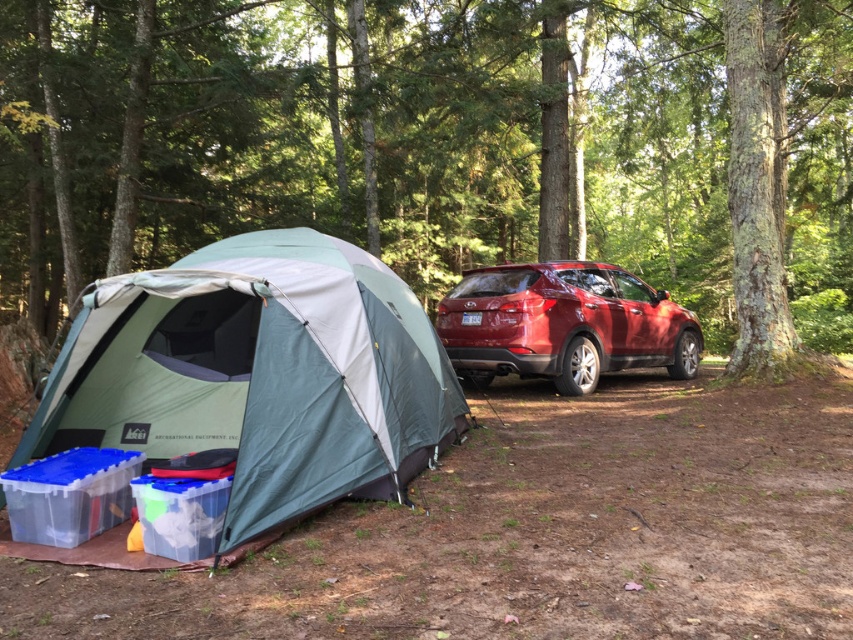
Is green textured tree at center shorter than green fabric tent at left?

In fact, green textured tree at center may be taller than green fabric tent at left.

Describe the element at coordinates (444, 145) in the screenshot. I see `green textured tree at center` at that location.

The width and height of the screenshot is (853, 640). Find the location of `green textured tree at center`. green textured tree at center is located at coordinates (444, 145).

Measure the distance between point (683,289) and camera.

They are 25.83 meters apart.

In the scene shown: Between green textured tree at center and shiny red suv at center, which one appears on the left side from the viewer's perspective?

shiny red suv at center is more to the left.

Who is more distant from viewer, (817, 88) or (645, 284)?

The point (817, 88) is more distant.

Locate an element on the screen. green textured tree at center is located at coordinates (444, 145).

Based on the photo, who is lower down, green fabric tent at left or shiny red suv at center?

green fabric tent at left

Can you confirm if green fabric tent at left is taller than shiny red suv at center?

Indeed, green fabric tent at left has a greater height compared to shiny red suv at center.

What do you see at coordinates (258, 374) in the screenshot? This screenshot has width=853, height=640. I see `green fabric tent at left` at bounding box center [258, 374].

Where is `green fabric tent at left`? The width and height of the screenshot is (853, 640). green fabric tent at left is located at coordinates (258, 374).